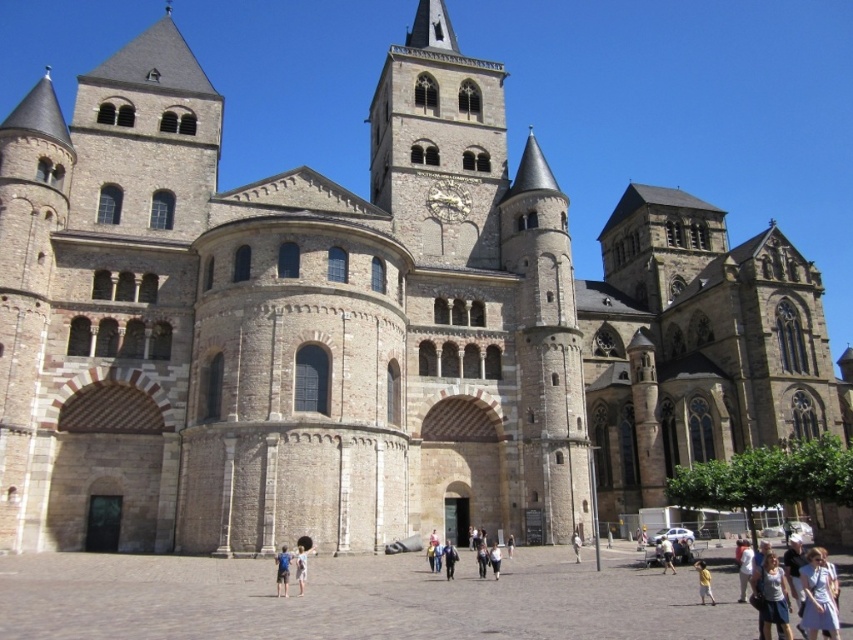
Question: Can you confirm if blue denim shorts at center is thinner than light blue denim jeans at center?

Choices:
 (A) yes
 (B) no

Answer: (B)

Question: Which of these objects is positioned closest to the blue fabric jacket at center?

Choices:
 (A) white cotton shirt at center
 (B) light brown leather jacket at center
 (C) light blue denim jeans at center
 (D) blue denim shorts at center

Answer: (C)

Question: Estimate the real-world distances between objects in this image. Which object is closer to the blue fabric jacket at center?

Choices:
 (A) yellow cotton shirt at lower right
 (B) blue denim shorts at center

Answer: (B)

Question: Is the position of blue denim shorts at center more distant than that of white cotton shirt at center?

Choices:
 (A) yes
 (B) no

Answer: (B)

Question: From the image, what is the correct spatial relationship of yellow cotton shirt at lower right in relation to light blue denim jeans at center?

Choices:
 (A) above
 (B) below

Answer: (B)

Question: Which point is farther to the camera?

Choices:
 (A) (578, 545)
 (B) (294, 577)
 (C) (666, 550)

Answer: (A)